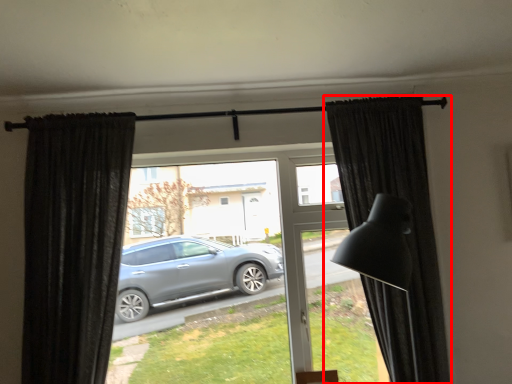
Question: In this image, where is curtain (annotated by the red box) located relative to curtain?

Choices:
 (A) left
 (B) right

Answer: (B)